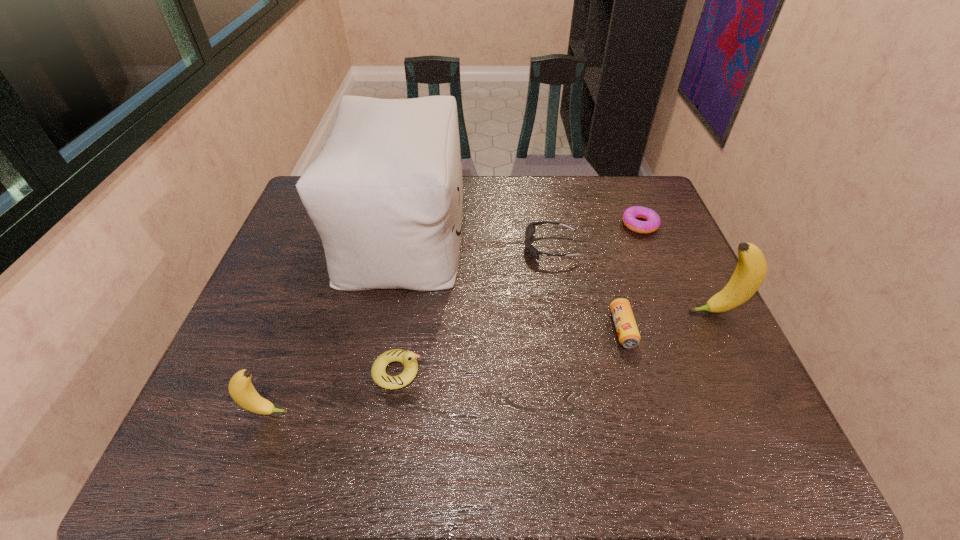
What are the coordinates of `free spot located on the left of the fifth object from left to right` in the screenshot? It's located at (522, 329).

Where is `cushion that is at the far edge`? This screenshot has width=960, height=540. cushion that is at the far edge is located at coordinates (385, 194).

What are the coordinates of `doughnut that is positioned at the far edge` in the screenshot? It's located at (652, 223).

At what (x,y) coordinates should I click in order to perform the action: click on banana located in the near edge section of the desktop. Please return your answer as a coordinate pair (x, y). This screenshot has width=960, height=540. Looking at the image, I should click on (242, 391).

The width and height of the screenshot is (960, 540). Find the location of `duckling present at the near edge`. duckling present at the near edge is located at coordinates point(408,358).

Where is `object that is at the left edge`? Image resolution: width=960 pixels, height=540 pixels. object that is at the left edge is located at coordinates (242, 391).

I want to click on banana situated at the right edge, so click(x=751, y=270).

Image resolution: width=960 pixels, height=540 pixels. I want to click on doughnut located in the right edge section of the desktop, so click(652, 223).

Where is `object that is at the near left corner`? The image size is (960, 540). object that is at the near left corner is located at coordinates (242, 391).

Find the location of a particular element. The height and width of the screenshot is (540, 960). object that is positioned at the far right corner is located at coordinates (652, 223).